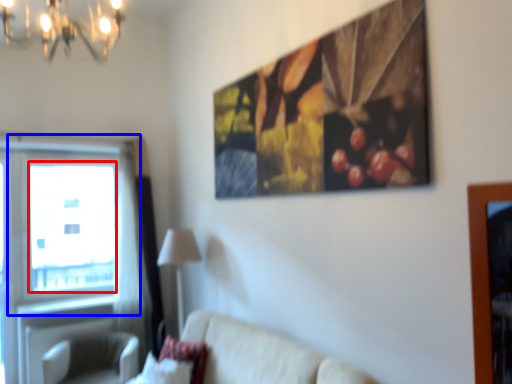
Question: Which point is further to the camera, window screen (highlighted by a red box) or window (highlighted by a blue box)?

Choices:
 (A) window screen
 (B) window

Answer: (A)